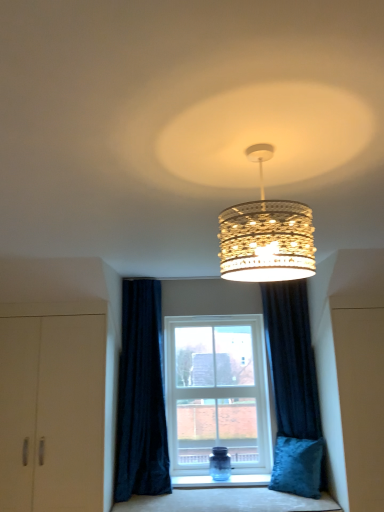
Question: Is matte beige cabinet at left not close to velvet blue cushion at lower center?

Choices:
 (A) no
 (B) yes

Answer: (A)

Question: Is matte beige cabinet at left further to the viewer compared to velvet blue cushion at lower center?

Choices:
 (A) no
 (B) yes

Answer: (A)

Question: Does matte beige cabinet at left have a lesser height compared to velvet blue cushion at lower center?

Choices:
 (A) no
 (B) yes

Answer: (A)

Question: Is velvet blue cushion at lower center a part of matte beige cabinet at left?

Choices:
 (A) no
 (B) yes

Answer: (A)

Question: Is matte beige cabinet at left oriented towards velvet blue cushion at lower center?

Choices:
 (A) yes
 (B) no

Answer: (B)

Question: Looking at their shapes, would you say velvet blue cushion at lower center is wider or thinner than white plastic window at center?

Choices:
 (A) wide
 (B) thin

Answer: (A)

Question: In the image, is velvet blue cushion at lower center on the left side or the right side of white plastic window at center?

Choices:
 (A) right
 (B) left

Answer: (A)

Question: Does point (261, 506) appear closer or farther from the camera than point (195, 454)?

Choices:
 (A) farther
 (B) closer

Answer: (B)

Question: Do you think velvet blue cushion at lower center is within white plastic window at center, or outside of it?

Choices:
 (A) inside
 (B) outside

Answer: (B)

Question: Relative to velvet blue cushion at lower center, is gold textured chandelier at center in front or behind?

Choices:
 (A) front
 (B) behind

Answer: (A)

Question: Considering the positions of gold textured chandelier at center and velvet blue cushion at lower center in the image, is gold textured chandelier at center wider or thinner than velvet blue cushion at lower center?

Choices:
 (A) wide
 (B) thin

Answer: (B)

Question: From the image's perspective, is gold textured chandelier at center positioned above or below velvet blue cushion at lower center?

Choices:
 (A) above
 (B) below

Answer: (A)

Question: Is gold textured chandelier at center bigger or smaller than velvet blue cushion at lower center?

Choices:
 (A) big
 (B) small

Answer: (B)

Question: From the image's perspective, is velvet blue cushion at lower center located above or below velvet blue pillow at lower right?

Choices:
 (A) above
 (B) below

Answer: (B)

Question: From a real-world perspective, is velvet blue cushion at lower center physically located above or below velvet blue pillow at lower right?

Choices:
 (A) above
 (B) below

Answer: (B)